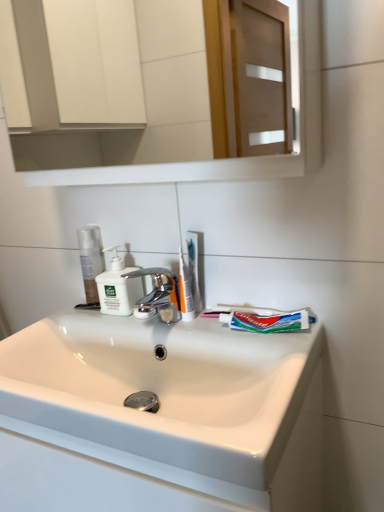
Question: Is translucent plastic toothbrush at center wider than clear plastic bottle at left?

Choices:
 (A) no
 (B) yes

Answer: (A)

Question: Is clear plastic bottle at left a part of translucent plastic toothbrush at center?

Choices:
 (A) no
 (B) yes

Answer: (A)

Question: Is translucent plastic toothbrush at center looking in the opposite direction of clear plastic bottle at left?

Choices:
 (A) yes
 (B) no

Answer: (B)

Question: From the image's perspective, would you say translucent plastic toothbrush at center is positioned over clear plastic bottle at left?

Choices:
 (A) no
 (B) yes

Answer: (A)

Question: From a real-world perspective, is translucent plastic toothbrush at center under clear plastic bottle at left?

Choices:
 (A) yes
 (B) no

Answer: (A)

Question: Is translucent plastic toothbrush at center taller or shorter than white glossy mirror at upper center?

Choices:
 (A) tall
 (B) short

Answer: (B)

Question: From a real-world perspective, is translucent plastic toothbrush at center positioned above or below white glossy mirror at upper center?

Choices:
 (A) below
 (B) above

Answer: (A)

Question: Is point (190, 297) positioned closer to the camera than point (23, 1)?

Choices:
 (A) farther
 (B) closer

Answer: (B)

Question: In the image, is translucent plastic toothbrush at center on the left side or the right side of white glossy mirror at upper center?

Choices:
 (A) right
 (B) left

Answer: (A)

Question: Is green matte toothpaste at center in front of or behind translucent plastic toothbrush at center in the image?

Choices:
 (A) behind
 (B) front

Answer: (B)

Question: Considering the positions of point (279, 315) and point (180, 305), is point (279, 315) closer or farther from the camera than point (180, 305)?

Choices:
 (A) closer
 (B) farther

Answer: (A)

Question: From the image's perspective, is green matte toothpaste at center located above or below translucent plastic toothbrush at center?

Choices:
 (A) above
 (B) below

Answer: (B)

Question: Considering the positions of green matte toothpaste at center and translucent plastic toothbrush at center in the image, is green matte toothpaste at center bigger or smaller than translucent plastic toothbrush at center?

Choices:
 (A) small
 (B) big

Answer: (B)

Question: From the image's perspective, is translucent plastic toothbrush at center above or below white matte soap dispenser at center?

Choices:
 (A) above
 (B) below

Answer: (A)

Question: Is translucent plastic toothbrush at center wider or thinner than white matte soap dispenser at center?

Choices:
 (A) wide
 (B) thin

Answer: (B)